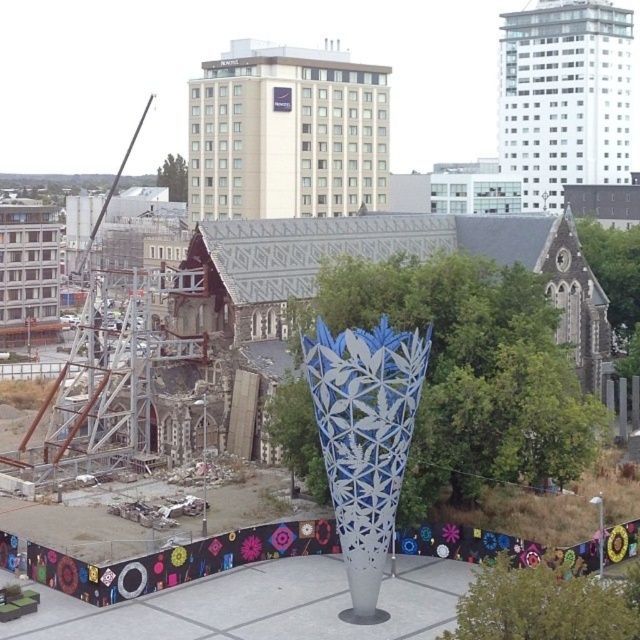
Question: Observing the image, what is the correct spatial positioning of green leafy tree at center in reference to green leafy tree at upper right?

Choices:
 (A) right
 (B) left

Answer: (B)

Question: Which object appears closest to the camera in this image?

Choices:
 (A) green leafy tree at center
 (B) green leafy tree at upper center

Answer: (A)

Question: Which of the following is the closest to the observer?

Choices:
 (A) green leafy tree at lower right
 (B) green leafy tree at upper center
 (C) green leafy tree at center
 (D) green leafy tree at upper right

Answer: (A)

Question: Does green leafy tree at center appear over green leafy tree at upper right?

Choices:
 (A) yes
 (B) no

Answer: (B)

Question: Is green leafy tree at lower right further to the viewer compared to green leafy tree at upper center?

Choices:
 (A) yes
 (B) no

Answer: (B)

Question: Which object is the closest to the green leafy tree at lower right?

Choices:
 (A) green leafy tree at upper right
 (B) green leafy tree at upper center
 (C) green leafy tree at center

Answer: (C)